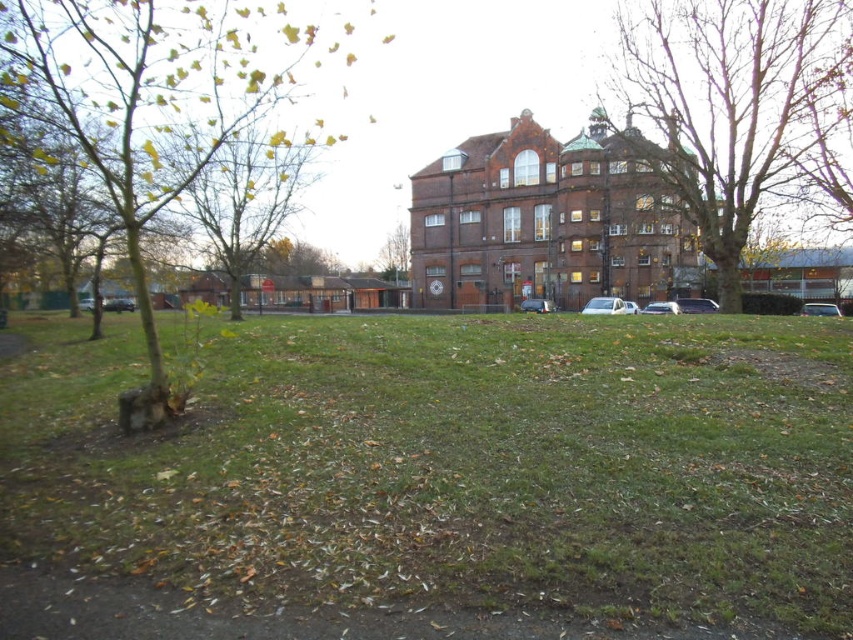
Is point (821, 314) closer to camera compared to point (653, 305)?

Yes, point (821, 314) is in front of point (653, 305).

Between white matte car at lower right and silver metallic car at center, which one has more height?

silver metallic car at center is taller.

Consider the image. Who is more distant from viewer, [805,314] or [662,301]?

Positioned behind is point [662,301].

The height and width of the screenshot is (640, 853). Find the location of `white matte car at lower right`. white matte car at lower right is located at coordinates (820, 308).

Which is below, brown wood tree at center or silver metallic car at center?

silver metallic car at center is below.

Which is behind, point (399, 256) or point (663, 312)?

The point (399, 256) is more distant.

Which is behind, point (402, 273) or point (643, 307)?

Positioned behind is point (402, 273).

You are a GUI agent. You are given a task and a screenshot of the screen. Output one action in this format:
    pyautogui.click(x=<x>, y=<y>)
    Task: Click on the brown wood tree at center
    This screenshot has width=853, height=640.
    Given the screenshot: What is the action you would take?
    pyautogui.click(x=395, y=253)

Which is in front, point (543, 305) or point (625, 310)?

Point (625, 310) is in front.

Who is positioned more to the left, white matte car at center or white glossy car at center?

white matte car at center

Is point (541, 300) positioned in front of point (633, 305)?

That is False.

I want to click on white matte car at center, so click(537, 305).